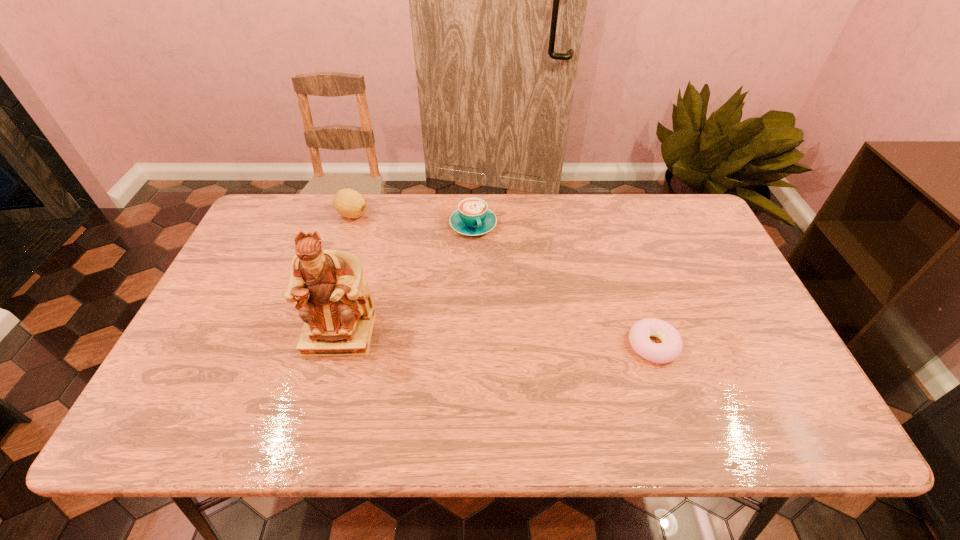
This screenshot has height=540, width=960. I want to click on object that stands as the second closest to the shortest object, so click(x=334, y=301).

The width and height of the screenshot is (960, 540). In order to click on object that is the closest to the tallest object in this screenshot , I will do `click(472, 217)`.

The width and height of the screenshot is (960, 540). What are the coordinates of `vacant region that satisfies the following two spatial constraints: 1. on the front-facing side of the figurine; 2. on the left side of the shortest object` in the screenshot? It's located at (337, 345).

In order to click on vacant region that satisfies the following two spatial constraints: 1. on the front side of the lemon; 2. on the left side of the rightmost object in this screenshot , I will do `click(311, 345)`.

Identify the location of vacant region that satisfies the following two spatial constraints: 1. on the front-facing side of the shortest object; 2. on the right side of the tallest object. (337, 345).